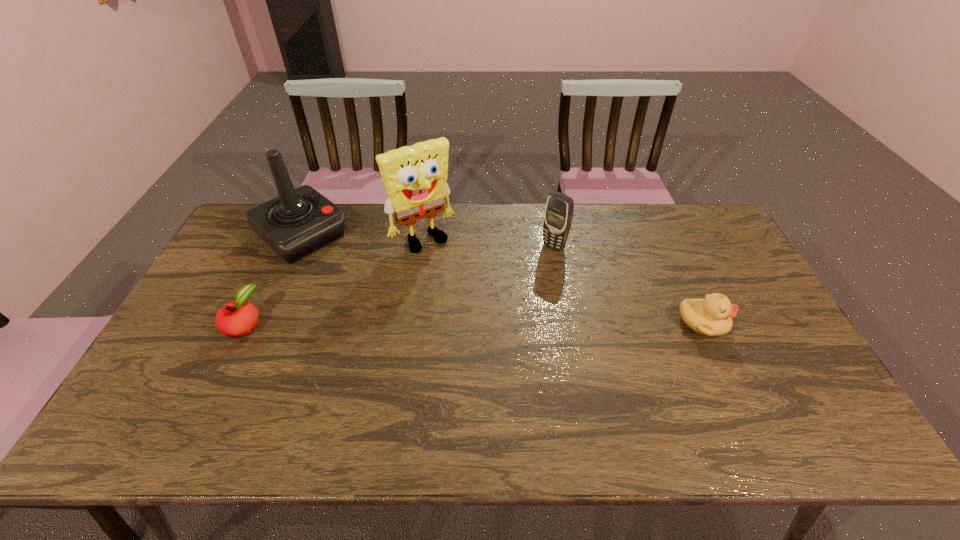
Identify the location of apple. The height and width of the screenshot is (540, 960). [234, 319].

At what (x,y) coordinates should I click in order to perform the action: click on duckling. Please return your answer as a coordinate pair (x, y). The image size is (960, 540). Looking at the image, I should click on (711, 316).

Image resolution: width=960 pixels, height=540 pixels. I want to click on the second shortest object, so click(x=711, y=316).

I want to click on the third object from left to right, so [x=415, y=177].

The image size is (960, 540). What are the coordinates of `cellular telephone` in the screenshot? It's located at (558, 215).

This screenshot has width=960, height=540. Find the location of `the second object from right to left`. the second object from right to left is located at coordinates (558, 215).

The height and width of the screenshot is (540, 960). Identify the location of joystick. (299, 221).

Where is `vacant space located on the right of the apple`? The height and width of the screenshot is (540, 960). vacant space located on the right of the apple is located at coordinates (406, 323).

You are a GUI agent. You are given a task and a screenshot of the screen. Output one action in this format:
    pyautogui.click(x=<x>, y=<y>)
    Task: Click on the free spot located 0.120m on the beak of the rightmost object
    This screenshot has width=960, height=540.
    Given the screenshot: What is the action you would take?
    [x=769, y=323]

The width and height of the screenshot is (960, 540). Identify the location of vacant space located 0.120m on the face of the third object from left to right. (455, 275).